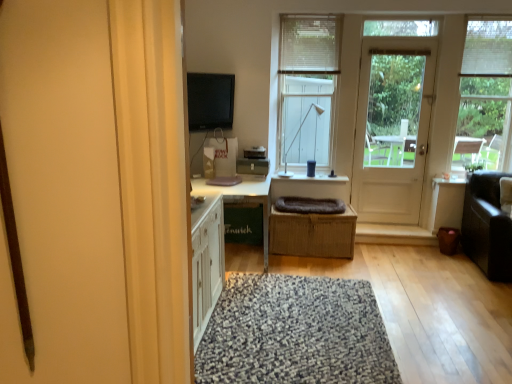
Question: Is white fabric blind at upper right, which is the 1th blind in right-to-left order, surrounding white plastic lamp at upper center?

Choices:
 (A) yes
 (B) no

Answer: (B)

Question: Is white fabric blind at upper right, which appears as the 2th blind when viewed from the left, bigger than white plastic lamp at upper center?

Choices:
 (A) no
 (B) yes

Answer: (A)

Question: Does white fabric blind at upper right, which is the 1th blind in right-to-left order, appear on the right side of white plastic lamp at upper center?

Choices:
 (A) no
 (B) yes

Answer: (B)

Question: Is white fabric blind at upper right, which is the 1th blind in right-to-left order, oriented towards white plastic lamp at upper center?

Choices:
 (A) no
 (B) yes

Answer: (A)

Question: Does white fabric blind at upper right, which appears as the 2th blind when viewed from the left, have a greater height compared to white plastic lamp at upper center?

Choices:
 (A) yes
 (B) no

Answer: (B)

Question: Is white fabric blind at upper right, which appears as the 2th blind when viewed from the left, wider than white plastic lamp at upper center?

Choices:
 (A) yes
 (B) no

Answer: (B)

Question: Is white wooden door at right outside of white wood window at center, the second window when ordered from right to left?

Choices:
 (A) no
 (B) yes

Answer: (B)

Question: Does white wooden door at right appear on the left side of white wood window at center, which is the first window in left-to-right order?

Choices:
 (A) no
 (B) yes

Answer: (A)

Question: Is white wooden door at right directly adjacent to white wood window at center, the second window when ordered from right to left?

Choices:
 (A) no
 (B) yes

Answer: (A)

Question: Considering the relative sizes of white wooden door at right and white wood window at center, which is the first window in left-to-right order, in the image provided, is white wooden door at right wider than white wood window at center, which is the first window in left-to-right order,?

Choices:
 (A) yes
 (B) no

Answer: (B)

Question: Is white wooden door at right facing towards white wood window at center, the second window when ordered from right to left?

Choices:
 (A) yes
 (B) no

Answer: (B)

Question: Are white wooden door at right and white wood window at center, the second window when ordered from right to left, located far from each other?

Choices:
 (A) yes
 (B) no

Answer: (B)

Question: From the image's perspective, is matte black flat screen tv at upper center beneath speckled woolen rug at center?

Choices:
 (A) no
 (B) yes

Answer: (A)